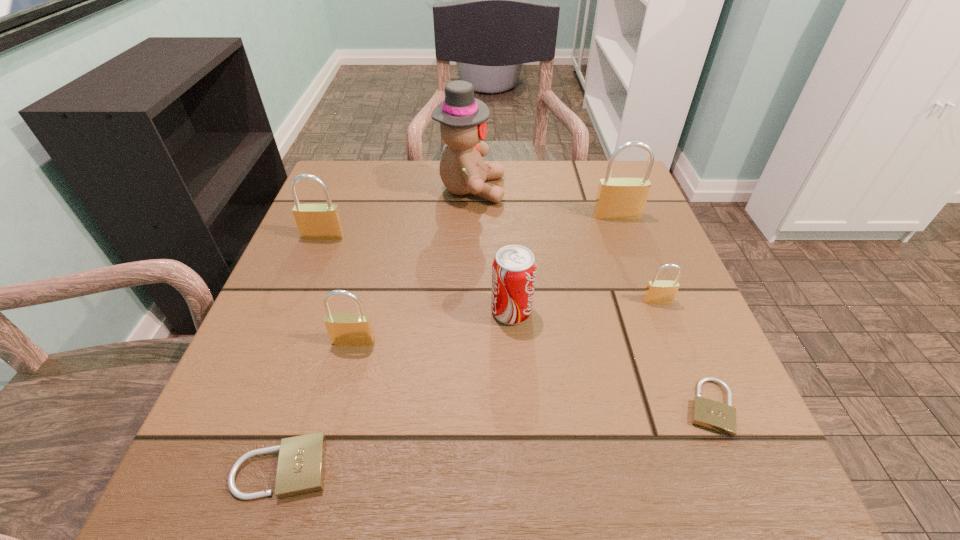
You are a GUI agent. You are given a task and a screenshot of the screen. Output one action in this format:
    pyautogui.click(x=<x>, y=<y>)
    Task: Click on the vacant space located 0.120m on the right of the seventh tallest object
    The height and width of the screenshot is (540, 960).
    Given the screenshot: What is the action you would take?
    pos(420,467)

The image size is (960, 540). Find the location of `vacant space located on the left of the shortest object`. vacant space located on the left of the shortest object is located at coordinates (590, 407).

Find the location of a particular element. The width and height of the screenshot is (960, 540). rag_doll present at the far edge is located at coordinates (462, 118).

Find the location of `padlock that is positioned at the far edge`. padlock that is positioned at the far edge is located at coordinates (617, 198).

The height and width of the screenshot is (540, 960). Find the location of `object located at the near edge`. object located at the near edge is located at coordinates (301, 463).

The height and width of the screenshot is (540, 960). Find the location of `object at the near left corner`. object at the near left corner is located at coordinates (301, 463).

Where is `object at the far right corner`? The width and height of the screenshot is (960, 540). object at the far right corner is located at coordinates (617, 198).

In the image, there is a desktop. Where is `vacant space at the far edge`? The width and height of the screenshot is (960, 540). vacant space at the far edge is located at coordinates click(x=424, y=182).

The width and height of the screenshot is (960, 540). Identify the location of vacant space at the near edge of the desktop. (466, 474).

Locate an element on the screen. The height and width of the screenshot is (540, 960). vacant space at the left edge of the desktop is located at coordinates (338, 247).